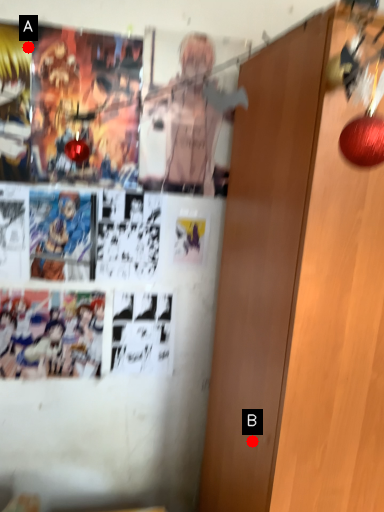
Question: Two points are circled on the image, labeled by A and B beside each circle. Among these points, which one is farthest from the camera?

Choices:
 (A) A is further
 (B) B is further

Answer: (A)